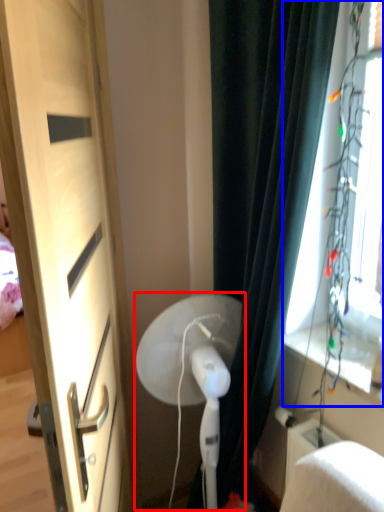
Question: Which of the following is the farthest to the observer, fan (highlighted by a red box) or window screen (highlighted by a blue box)?

Choices:
 (A) fan
 (B) window screen

Answer: (A)